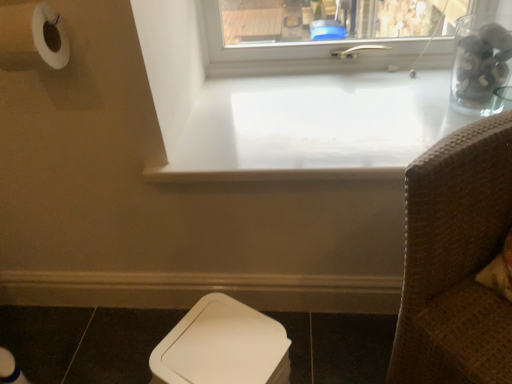
Question: Is point (286, 352) closer or farther from the camera than point (30, 344)?

Choices:
 (A) closer
 (B) farther

Answer: (A)

Question: From a real-world perspective, is white plastic toilet bowl at lower center above or below dark brown tile at lower left?

Choices:
 (A) above
 (B) below

Answer: (A)

Question: Considering the real-world distances, which object is closest to the white plastic toilet bowl at lower center?

Choices:
 (A) transparent glass jar at upper right
 (B) white glossy counter top at center
 (C) clear glass jar at upper right
 (D) dark brown tile at lower left
 (E) brown woven chair at right

Answer: (E)

Question: Which is nearer to the brown woven chair at right?

Choices:
 (A) dark brown tile at lower left
 (B) clear glass jar at upper right
 (C) transparent glass jar at upper right
 (D) white glossy counter top at center
 (E) white plastic toilet bowl at lower center

Answer: (E)